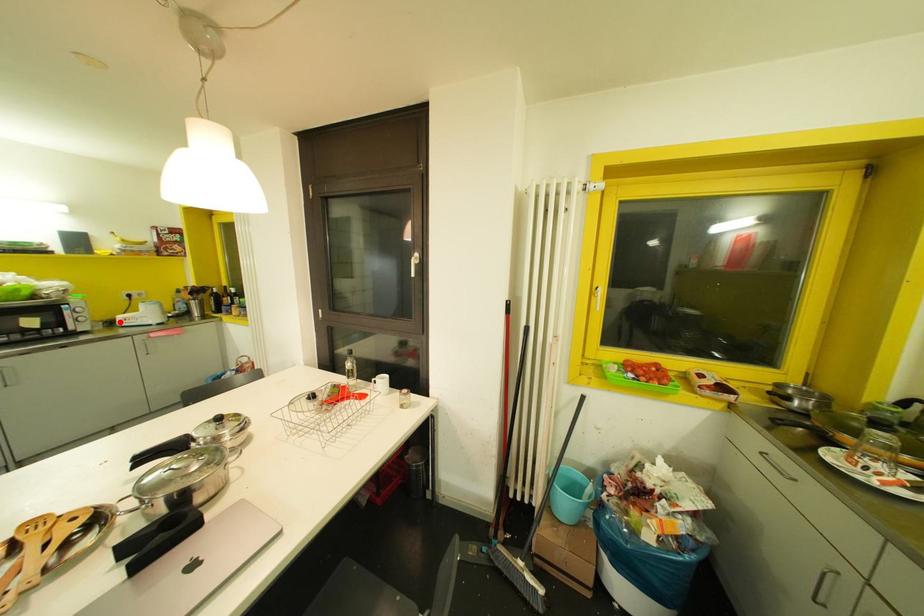
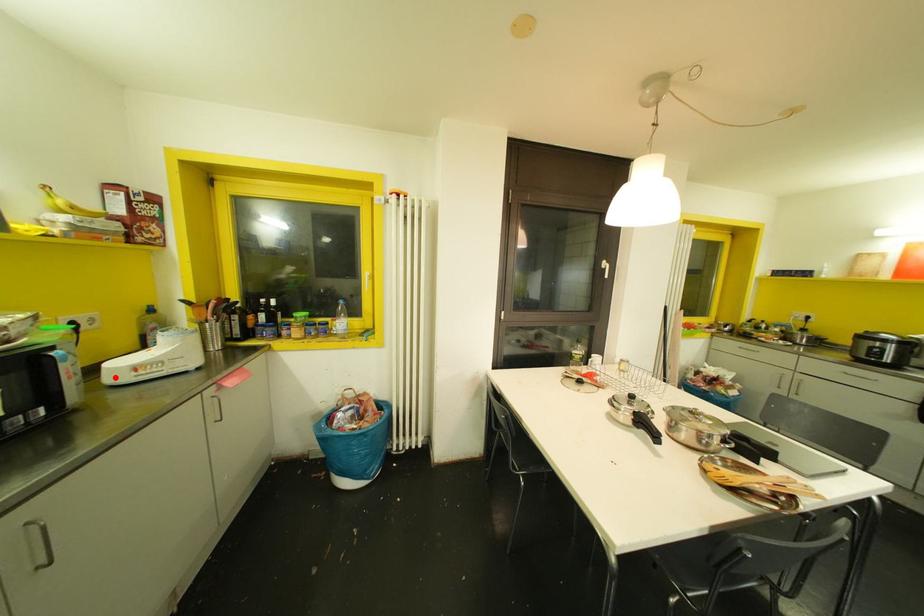
I am providing you with two images of the same scene from different viewpoints. A red point is marked on the first image and another point is marked on the second image. Do the highlighted points in image1 and image2 indicate the same real-world spot?

Yes